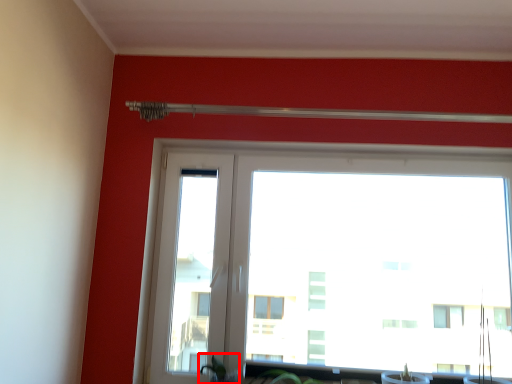
Question: From the image's perspective, where is plant (annotated by the red box) located in relation to window in the image?

Choices:
 (A) above
 (B) below

Answer: (B)